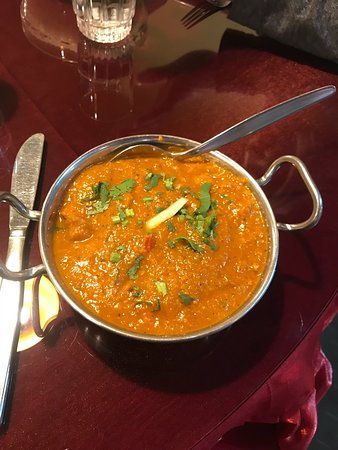
Locate an element on the screen. The height and width of the screenshot is (450, 338). butter knife is located at coordinates (30, 171).